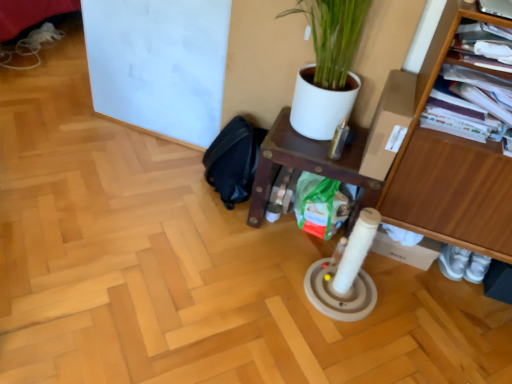
Question: Considering the relative positions of wooden shelf at center and wooden shelf at right in the image provided, is wooden shelf at center to the right of wooden shelf at right from the viewer's perspective?

Choices:
 (A) no
 (B) yes

Answer: (A)

Question: Considering the relative sizes of wooden shelf at center and wooden shelf at right in the image provided, is wooden shelf at center taller than wooden shelf at right?

Choices:
 (A) no
 (B) yes

Answer: (A)

Question: Is wooden shelf at center touching wooden shelf at right?

Choices:
 (A) yes
 (B) no

Answer: (B)

Question: Does wooden shelf at center have a greater width compared to wooden shelf at right?

Choices:
 (A) no
 (B) yes

Answer: (B)

Question: Can you confirm if wooden shelf at center is shorter than wooden shelf at right?

Choices:
 (A) no
 (B) yes

Answer: (B)

Question: Can you confirm if wooden shelf at center is bigger than wooden shelf at right?

Choices:
 (A) yes
 (B) no

Answer: (B)

Question: Does wooden shelf at right have a smaller size compared to wooden shelf at center?

Choices:
 (A) yes
 (B) no

Answer: (B)

Question: Can you confirm if wooden shelf at right is shorter than wooden shelf at center?

Choices:
 (A) no
 (B) yes

Answer: (A)

Question: Is wooden shelf at right outside of wooden shelf at center?

Choices:
 (A) yes
 (B) no

Answer: (A)

Question: Would you consider wooden shelf at right to be distant from wooden shelf at center?

Choices:
 (A) yes
 (B) no

Answer: (B)

Question: Considering the relative positions of wooden shelf at right and wooden shelf at center in the image provided, is wooden shelf at right to the left of wooden shelf at center from the viewer's perspective?

Choices:
 (A) yes
 (B) no

Answer: (B)

Question: Considering the relative positions of wooden shelf at right and wooden shelf at center in the image provided, is wooden shelf at right to the right of wooden shelf at center from the viewer's perspective?

Choices:
 (A) yes
 (B) no

Answer: (A)

Question: Does black fabric swivel chair at lower center have a smaller size compared to wooden shelf at right?

Choices:
 (A) yes
 (B) no

Answer: (A)